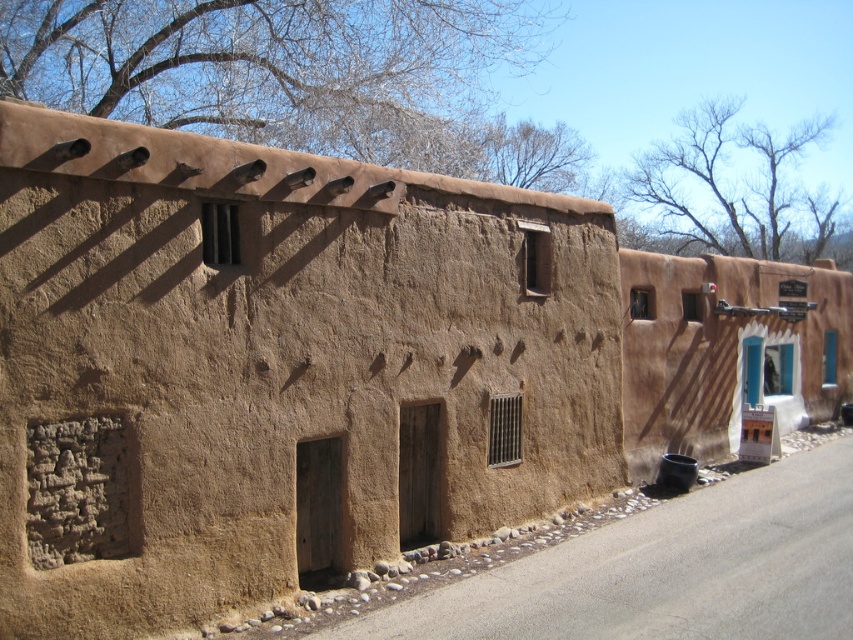
Question: Can you confirm if brown mudbrick wall at center is smaller than brown adobe wall at right?

Choices:
 (A) no
 (B) yes

Answer: (B)

Question: Is brown mudbrick wall at center wider than brown adobe wall at right?

Choices:
 (A) yes
 (B) no

Answer: (B)

Question: Which point appears farthest from the camera in this image?

Choices:
 (A) (30, 227)
 (B) (805, 340)

Answer: (B)

Question: Which object appears closest to the camera in this image?

Choices:
 (A) brown adobe wall at right
 (B) brown mudbrick wall at center

Answer: (B)

Question: Which point is closer to the camera?

Choices:
 (A) brown adobe wall at right
 (B) brown mudbrick wall at center

Answer: (B)

Question: Does brown mudbrick wall at center have a greater width compared to brown adobe wall at right?

Choices:
 (A) yes
 (B) no

Answer: (B)